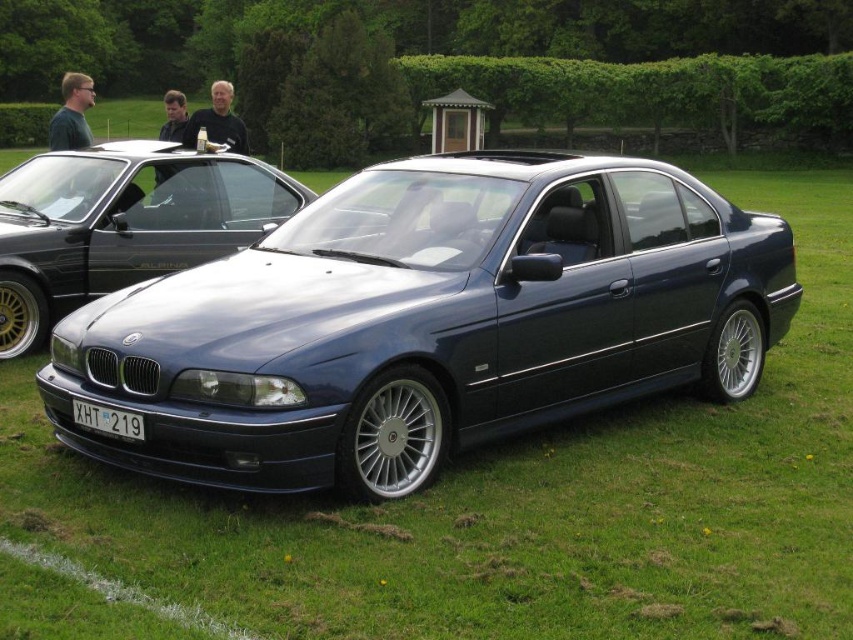
Is the position of satin blue car at center more distant than that of black plastic license plate at center?

Yes, it is behind black plastic license plate at center.

Is satin blue car at center positioned in front of black plastic license plate at center?

No, it is behind black plastic license plate at center.

Between point (74, 150) and point (119, 429), which one is positioned in front?

Point (119, 429) is more forward.

You are a GUI agent. You are given a task and a screenshot of the screen. Output one action in this format:
    pyautogui.click(x=<x>, y=<y>)
    Task: Click on the satin blue car at center
    
    Given the screenshot: What is the action you would take?
    pyautogui.click(x=122, y=224)

The width and height of the screenshot is (853, 640). I want to click on metallic blue sedan at center, so click(427, 321).

Is point (358, 468) positioned before point (189, 211)?

Yes, point (358, 468) is closer to viewer.

Is point (432, 305) in front of point (12, 209)?

Yes, point (432, 305) is in front of point (12, 209).

I want to click on metallic blue sedan at center, so click(x=427, y=321).

Between metallic blue sedan at center and black plastic license plate at center, which one has less height?

black plastic license plate at center

Who is positioned more to the right, metallic blue sedan at center or black plastic license plate at center?

From the viewer's perspective, metallic blue sedan at center appears more on the right side.

Is point (373, 452) positioned behind point (109, 433)?

Yes.

Image resolution: width=853 pixels, height=640 pixels. In order to click on metallic blue sedan at center in this screenshot , I will do `click(427, 321)`.